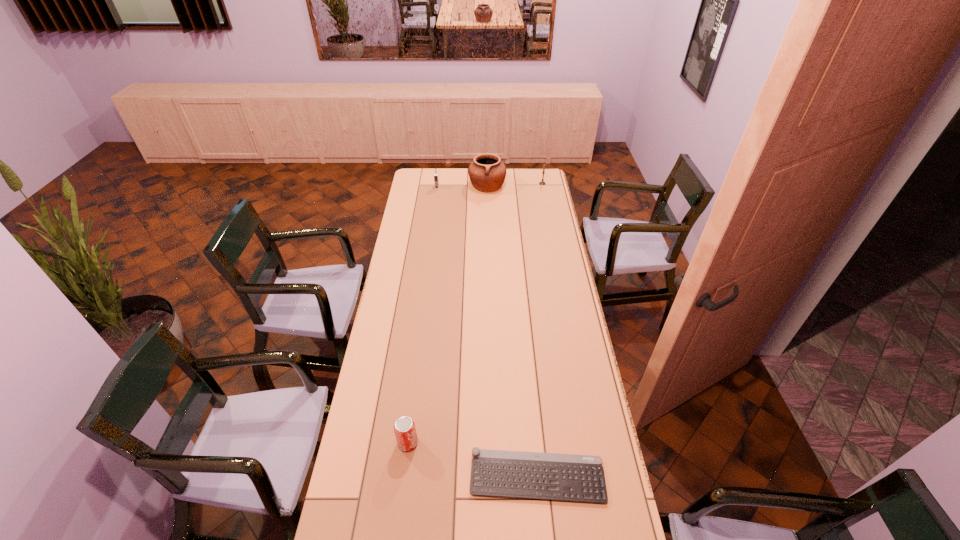
Locate an element on the screen. The image size is (960, 540). blank space at the left edge of the desktop is located at coordinates (425, 201).

In the image, there is a desktop. Where is `vacant space at the right edge`? vacant space at the right edge is located at coordinates (537, 228).

Identify the location of vacant space at the far left corner of the desktop. (419, 185).

Identify the location of free space at the far right corner. (529, 175).

In order to click on unoccupied area between the pottery and the cellular telephone in this screenshot , I will do `click(462, 187)`.

Image resolution: width=960 pixels, height=540 pixels. Identify the location of empty location between the candle and the pottery. [515, 184].

Identify the location of unoccupied position between the pottery and the soda can. (447, 314).

Identify which object is the closest to the soda can. Please provide its 2D coordinates. Your answer should be formatted as a tuple, i.e. [(x, y)], where the tuple contains the x and y coordinates of a point satisfying the conditions above.

[(533, 475)]

What are the coordinates of `object that can be found as the fourth closest to the shortest object` in the screenshot? It's located at (543, 172).

Identify the location of free location that satisfies the following two spatial constraints: 1. on the front-facing side of the cellular telephone; 2. on the right side of the computer keyboard. The width and height of the screenshot is (960, 540). (398, 477).